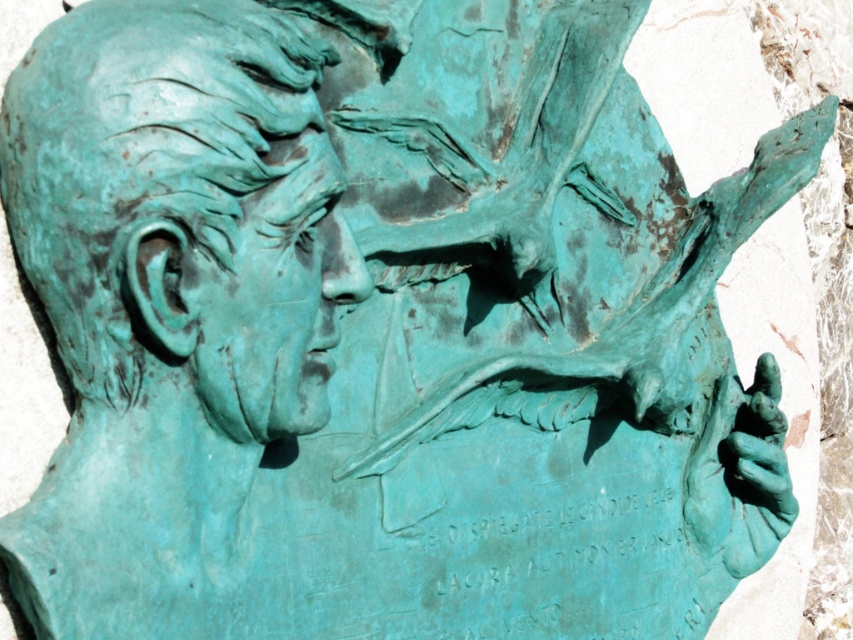
You are an art conservator examining the sculpture. You notice two areas with green patina, the green patina bust at center and the green patina face at center. Which one is positioned higher?

The green patina bust at center is positioned higher than the green patina face at center.

You are an art conservator examining the bronze sculpture. You notice two areas with green patina, the green patina bust at center and the green patina face at center. Which of these has a greater surface area?

The green patina bust at center has a greater surface area because it is larger in size than the green patina face at center.